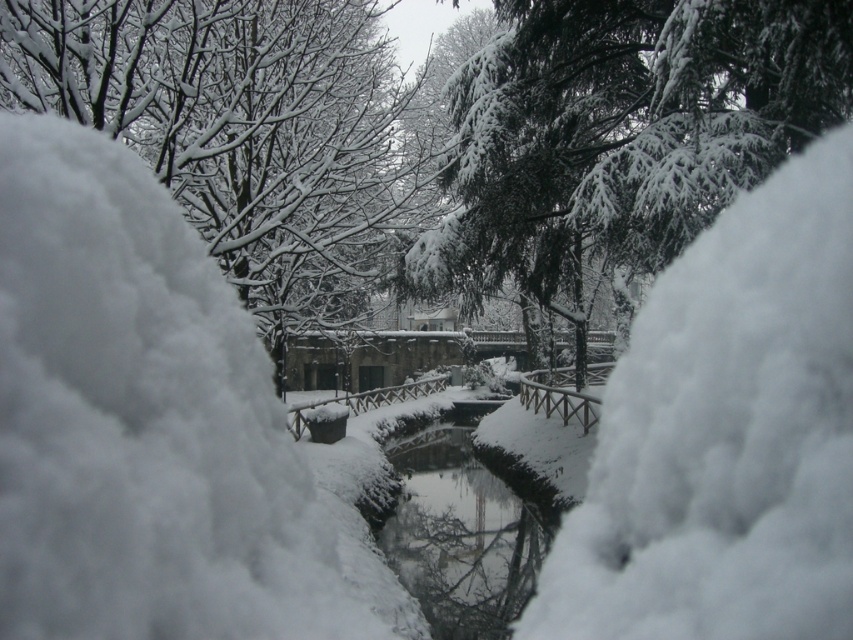
Question: Estimate the real-world distances between objects in this image. Which object is closer to the white fluffy snow at center?

Choices:
 (A) smooth ice water at center
 (B) snow-covered evergreen tree at center
 (C) snowy branches at center

Answer: (B)

Question: Which of the following is the closest to the observer?

Choices:
 (A) (224, 262)
 (B) (445, 628)
 (C) (250, 557)
 (D) (575, 280)

Answer: (C)

Question: Is white fluffy snow at center below smooth ice water at center?

Choices:
 (A) yes
 (B) no

Answer: (B)

Question: Is snowy branches at center bigger than smooth ice water at center?

Choices:
 (A) yes
 (B) no

Answer: (A)

Question: Observing the image, what is the correct spatial positioning of white fluffy snow at center in reference to snowy branches at center?

Choices:
 (A) right
 (B) left

Answer: (A)

Question: Which point is closer to the camera?

Choices:
 (A) snowy branches at center
 (B) snow-covered evergreen tree at center

Answer: (A)